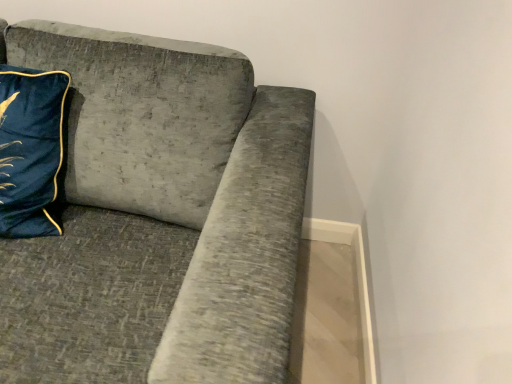
Looking at this image, in order to face velvet gray couch at upper left, should I rotate leftwards or rightwards?

Rotate your view left by about 23.998°.

The width and height of the screenshot is (512, 384). I want to click on velvet gray couch at upper left, so click(x=191, y=181).

Describe the element at coordinates (191, 181) in the screenshot. I see `velvet gray couch at upper left` at that location.

You are a GUI agent. You are given a task and a screenshot of the screen. Output one action in this format:
    pyautogui.click(x=<x>, y=<y>)
    Task: Click on the velvet gray couch at upper left
    Image resolution: width=512 pixels, height=384 pixels.
    Given the screenshot: What is the action you would take?
    pyautogui.click(x=191, y=181)